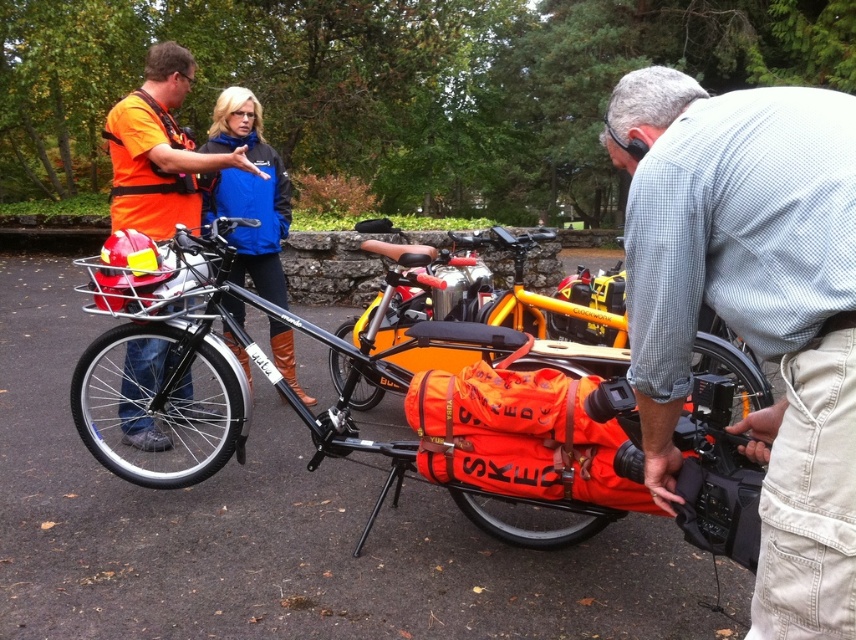
Can you confirm if gray checkered shirt at center is positioned above orange fabric cargo bike at center?

Incorrect, gray checkered shirt at center is not positioned above orange fabric cargo bike at center.

This screenshot has width=856, height=640. What are the coordinates of `gray checkered shirt at center` in the screenshot? It's located at (752, 308).

Where is `gray checkered shirt at center`? This screenshot has width=856, height=640. gray checkered shirt at center is located at coordinates (752, 308).

Between gray checkered shirt at center and blue fabric jacket at upper center, which one has more height?

blue fabric jacket at upper center is taller.

Measure the distance from gray checkered shirt at center to blue fabric jacket at upper center.

The distance of gray checkered shirt at center from blue fabric jacket at upper center is 6.27 feet.

Who is more forward, [798,284] or [278,225]?

Point [798,284] is in front.

At what (x,y) coordinates should I click in order to perform the action: click on gray checkered shirt at center. Please return your answer as a coordinate pair (x, y). Looking at the image, I should click on (752, 308).

Who is shorter, orange fabric bag at lower center or orange life vest at left?

With less height is orange fabric bag at lower center.

Who is more distant from viewer, (x=575, y=312) or (x=186, y=92)?

The point (x=186, y=92) is behind.

What are the coordinates of `orange fabric bag at lower center` in the screenshot? It's located at (485, 316).